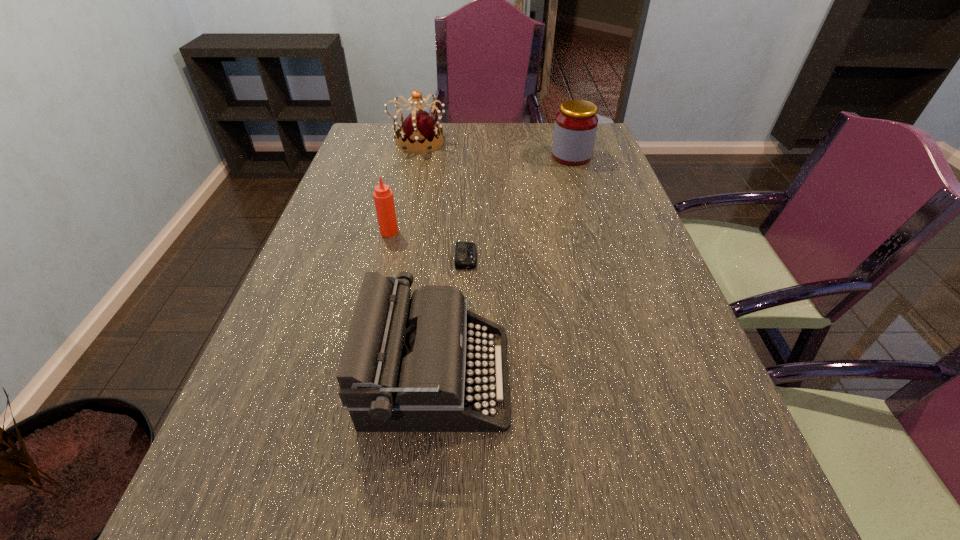
You are a GUI agent. You are given a task and a screenshot of the screen. Output one action in this format:
    pyautogui.click(x=<x>, y=<y>)
    Task: Click on the vacant space located 0.140m on the display of the shortest object
    The image size is (960, 540).
    Given the screenshot: What is the action you would take?
    pyautogui.click(x=534, y=258)

The height and width of the screenshot is (540, 960). What are the coordinates of `tiara that is at the far edge` in the screenshot? It's located at (419, 131).

Identify the location of jar situated at the far edge. The image size is (960, 540). (576, 123).

The height and width of the screenshot is (540, 960). In order to click on object located at the left edge in this screenshot , I will do `click(419, 131)`.

Where is `object that is at the right edge`? Image resolution: width=960 pixels, height=540 pixels. object that is at the right edge is located at coordinates (576, 123).

Where is `object present at the far left corner`? The image size is (960, 540). object present at the far left corner is located at coordinates (419, 131).

Locate an element on the screen. This screenshot has width=960, height=540. object that is at the far right corner is located at coordinates (576, 123).

Locate an element on the screen. The width and height of the screenshot is (960, 540). vacant space at the far edge is located at coordinates (462, 127).

The image size is (960, 540). In the image, there is a desktop. Identify the location of free space at the left edge. (334, 185).

Where is `vacant space at the right edge of the desktop`? This screenshot has width=960, height=540. vacant space at the right edge of the desktop is located at coordinates (630, 244).